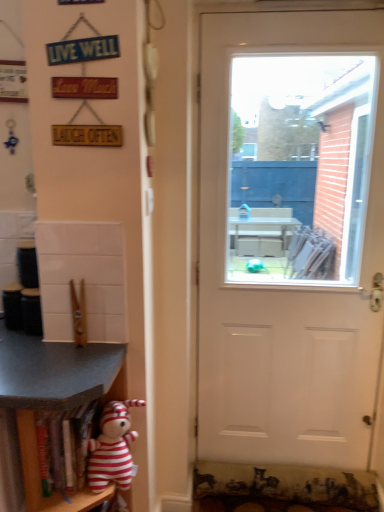
This screenshot has height=512, width=384. I want to click on empty space that is ontop of wooden shelf at lower left, the second shelf from the right (from a real-world perspective), so click(47, 353).